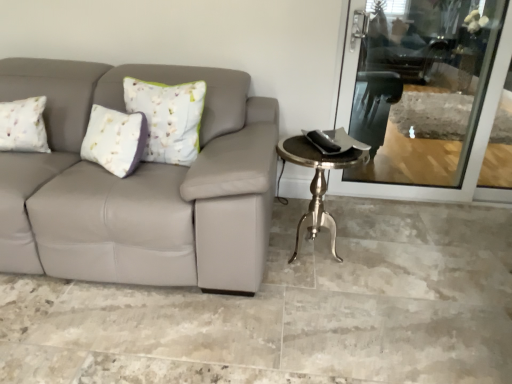
Question: Could you tell me if transparent glass screen door at upper right is facing silver metallic table at right?

Choices:
 (A) yes
 (B) no

Answer: (A)

Question: From a real-world perspective, is transparent glass screen door at upper right over silver metallic table at right?

Choices:
 (A) no
 (B) yes

Answer: (B)

Question: Is transparent glass screen door at upper right bigger than silver metallic table at right?

Choices:
 (A) yes
 (B) no

Answer: (B)

Question: From a real-world perspective, is transparent glass screen door at upper right beneath silver metallic table at right?

Choices:
 (A) yes
 (B) no

Answer: (B)

Question: Is silver metallic table at right surrounded by transparent glass screen door at upper right?

Choices:
 (A) yes
 (B) no

Answer: (B)

Question: From the image's perspective, does transparent glass screen door at upper right appear lower than silver metallic table at right?

Choices:
 (A) yes
 (B) no

Answer: (B)

Question: Would you consider metallic silver swivel chair at upper right to be distant from silver metallic table at right?

Choices:
 (A) yes
 (B) no

Answer: (A)

Question: Is silver metallic table at right a part of metallic silver swivel chair at upper right?

Choices:
 (A) no
 (B) yes

Answer: (A)

Question: Is metallic silver swivel chair at upper right beside silver metallic table at right?

Choices:
 (A) yes
 (B) no

Answer: (B)

Question: Does metallic silver swivel chair at upper right have a greater height compared to silver metallic table at right?

Choices:
 (A) yes
 (B) no

Answer: (A)

Question: Is metallic silver swivel chair at upper right positioned before silver metallic table at right?

Choices:
 (A) no
 (B) yes

Answer: (A)

Question: Is metallic silver swivel chair at upper right facing away from silver metallic table at right?

Choices:
 (A) yes
 (B) no

Answer: (B)

Question: Is metallic silver swivel chair at upper right looking in the opposite direction of transparent glass screen door at upper right?

Choices:
 (A) no
 (B) yes

Answer: (A)